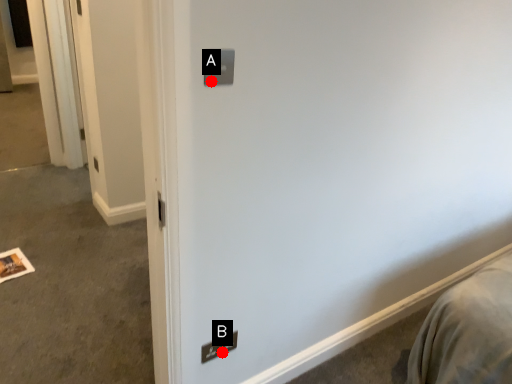
Question: Two points are circled on the image, labeled by A and B beside each circle. Which of the following is the farthest from the observer?

Choices:
 (A) A is further
 (B) B is further

Answer: (B)